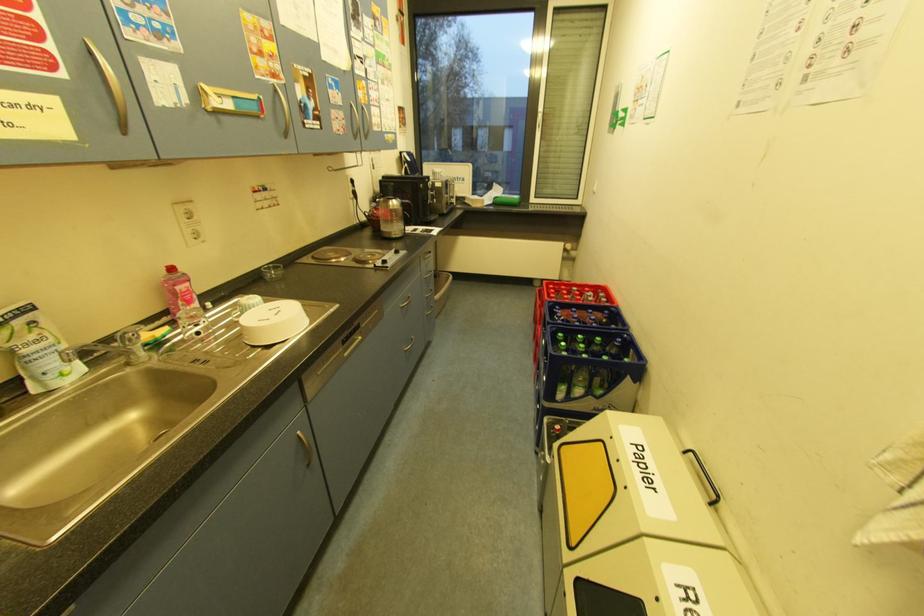
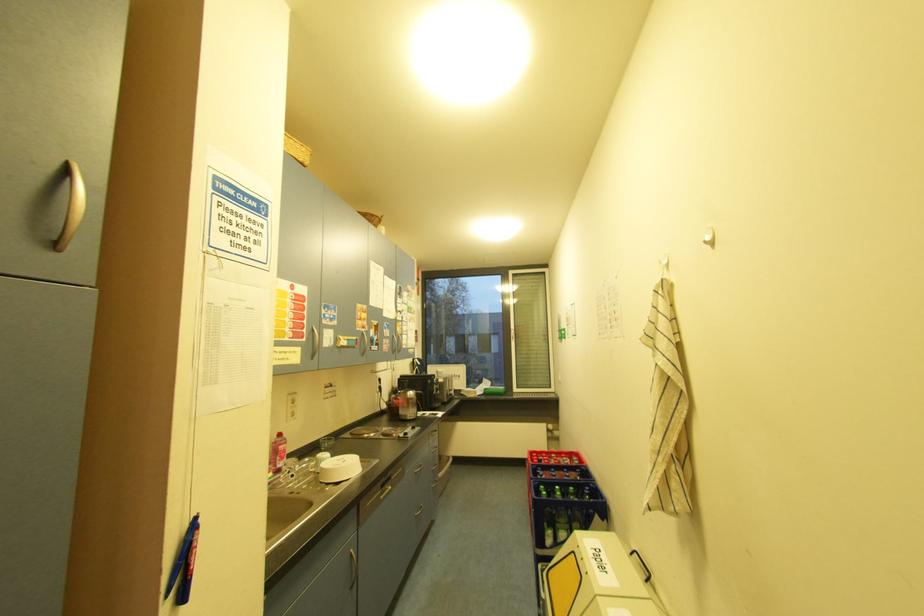
Question: The images are taken continuously from a first-person perspective. In which direction is your viewpoint rotating?

Choices:
 (A) Left
 (B) Right
 (C) Up
 (D) Down

Answer: (C)